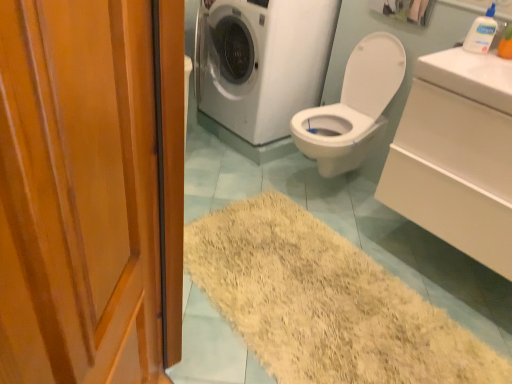
Describe the element at coordinates (78, 194) in the screenshot. Image resolution: width=512 pixels, height=384 pixels. I see `wooden door at left` at that location.

You are a GUI agent. You are given a task and a screenshot of the screen. Output one action in this format:
    pyautogui.click(x=<x>, y=<y>)
    Task: Click on the wooden door at left
    The height and width of the screenshot is (384, 512).
    Given the screenshot: What is the action you would take?
    pyautogui.click(x=78, y=194)

What do you see at coordinates (457, 155) in the screenshot? I see `white glossy sink at upper right, which is the second counter top in top-to-bottom order` at bounding box center [457, 155].

Locate an element on the screen. This screenshot has height=384, width=512. white glossy toilet at center is located at coordinates (353, 107).

You are a GUI agent. You are given a task and a screenshot of the screen. Output one action in this format:
    pyautogui.click(x=<x>, y=<y>)
    Task: Click on the white glossy washing machine at upper center
    The width and height of the screenshot is (512, 384).
    Given the screenshot: What is the action you would take?
    pyautogui.click(x=261, y=62)

The width and height of the screenshot is (512, 384). Find the location of `wooden door at left`. wooden door at left is located at coordinates (78, 194).

From the image's perspective, which is above, white glossy sink at upper right, which is counted as the 1th counter top, starting from the bottom, or white glossy sink at upper right, marked as the first counter top in a top-to-bottom arrangement?

white glossy sink at upper right, marked as the first counter top in a top-to-bottom arrangement, appears higher in the image.

Is white glossy sink at upper right, which is the second counter top in top-to-bottom order, in contact with white glossy sink at upper right, marked as the first counter top in a top-to-bottom arrangement?

white glossy sink at upper right, which is the second counter top in top-to-bottom order, and white glossy sink at upper right, marked as the first counter top in a top-to-bottom arrangement, are clearly separated.

Based on the photo, between white glossy sink at upper right, which is counted as the 1th counter top, starting from the bottom, and white glossy sink at upper right, the second counter top when ordered from bottom to top, which one has more height?

white glossy sink at upper right, which is counted as the 1th counter top, starting from the bottom.

Choose the correct answer: Is white glossy sink at upper right, which is counted as the 1th counter top, starting from the bottom, inside white glossy sink at upper right, marked as the first counter top in a top-to-bottom arrangement, or outside it?

white glossy sink at upper right, which is counted as the 1th counter top, starting from the bottom, is located beyond the bounds of white glossy sink at upper right, marked as the first counter top in a top-to-bottom arrangement.

Is clear plastic bottle at upper right positioned with its back to wooden door at left?

No, clear plastic bottle at upper right's orientation is not away from wooden door at left.

Between clear plastic bottle at upper right and wooden door at left, which one appears on the right side from the viewer's perspective?

From the viewer's perspective, clear plastic bottle at upper right appears more on the right side.

Does point (492, 3) come farther from viewer compared to point (75, 303)?

Yes, point (492, 3) is farther from viewer.

Does clear plastic bottle at upper right contain wooden door at left?

No.

Between white glossy washing machine at upper center and clear plastic bottle at upper right, which one has larger size?

Bigger between the two is white glossy washing machine at upper center.

From a real-world perspective, is white glossy washing machine at upper center positioned above or below clear plastic bottle at upper right?

white glossy washing machine at upper center is below clear plastic bottle at upper right.

Is white glossy washing machine at upper center aimed at clear plastic bottle at upper right?

No, white glossy washing machine at upper center is not facing towards clear plastic bottle at upper right.

Considering their positions, is white glossy washing machine at upper center located in front of or behind clear plastic bottle at upper right?

Visually, white glossy washing machine at upper center is located behind clear plastic bottle at upper right.

Considering the sizes of white glossy toilet at center and white glossy washing machine at upper center in the image, is white glossy toilet at center wider or thinner than white glossy washing machine at upper center?

white glossy toilet at center is thinner than white glossy washing machine at upper center.

How different are the orientations of white glossy toilet at center and white glossy washing machine at upper center in degrees?

2.86e-05 degrees separate the facing orientations of white glossy toilet at center and white glossy washing machine at upper center.

Is the depth of white glossy toilet at center greater than that of white glossy washing machine at upper center?

No, white glossy toilet at center is closer to the viewer.

Is white glossy toilet at center positioned with its back to white glossy washing machine at upper center?

No, white glossy toilet at center's orientation is not away from white glossy washing machine at upper center.

Locate an element on the screen. The image size is (512, 384). toilet paper on the left of white glossy sink at upper right, which is counted as the 1th counter top, starting from the bottom is located at coordinates (405, 10).

Considering the sizes of objects white glossy sink at upper right, which is the second counter top in top-to-bottom order, and white paper towel at upper center in the image provided, who is shorter, white glossy sink at upper right, which is the second counter top in top-to-bottom order, or white paper towel at upper center?

white paper towel at upper center.

From the image's perspective, between white glossy sink at upper right, which is the second counter top in top-to-bottom order, and white paper towel at upper center, which one is located above?

white paper towel at upper center is shown above in the image.

What's the angular difference between white glossy sink at upper right, which is the second counter top in top-to-bottom order, and white paper towel at upper center's facing directions?

0.198 degrees separate the facing orientations of white glossy sink at upper right, which is the second counter top in top-to-bottom order, and white paper towel at upper center.

Is white glossy washing machine at upper center a part of white glossy sink at upper right, which is counted as the 1th counter top, starting from the bottom?

No, white glossy washing machine at upper center is located outside of white glossy sink at upper right, which is counted as the 1th counter top, starting from the bottom.

Is white glossy sink at upper right, which is counted as the 1th counter top, starting from the bottom, facing towards white glossy washing machine at upper center?

No, white glossy sink at upper right, which is counted as the 1th counter top, starting from the bottom, is not facing towards white glossy washing machine at upper center.

From a real-world perspective, is white glossy sink at upper right, which is counted as the 1th counter top, starting from the bottom, located beneath white glossy washing machine at upper center?

No.

From a real-world perspective, which counter top is the 1st one above the white glossy washing machine at upper center? Please provide its 2D coordinates.

[(457, 155)]

Considering their positions, is white paper towel at upper center located in front of or behind white glossy sink at upper right, which is the second counter top in top-to-bottom order?

Clearly, white paper towel at upper center is behind white glossy sink at upper right, which is the second counter top in top-to-bottom order.

Which object is positioned more to the right, white paper towel at upper center or white glossy sink at upper right, which is counted as the 1th counter top, starting from the bottom?

From the viewer's perspective, white glossy sink at upper right, which is counted as the 1th counter top, starting from the bottom, appears more on the right side.

Is white paper towel at upper center shorter than white glossy sink at upper right, which is the second counter top in top-to-bottom order?

Yes.

From the image's perspective, which one is positioned lower, white paper towel at upper center or white glossy sink at upper right, which is counted as the 1th counter top, starting from the bottom?

white glossy sink at upper right, which is counted as the 1th counter top, starting from the bottom, from the image's perspective.

In order to click on counter top located below the white glossy sink at upper right, marked as the first counter top in a top-to-bottom arrangement (from the image's perspective) in this screenshot , I will do `click(457, 155)`.

Locate an element on the screen. toiletry above the wooden door at left (from the image's perspective) is located at coordinates (481, 32).

Looking at the image, which one is located closer to white glossy washing machine at upper center, clear plastic bottle at upper right or wooden door at left?

Among the two, clear plastic bottle at upper right is located nearer to white glossy washing machine at upper center.

Which object lies nearer to the anchor point white glossy washing machine at upper center, white glossy toilet at center or wooden door at left?

white glossy toilet at center is positioned closer to the anchor white glossy washing machine at upper center.

From the image, which object appears to be farther from white glossy sink at upper right, which is counted as the 1th counter top, starting from the bottom, white glossy sink at upper right, marked as the first counter top in a top-to-bottom arrangement, or white paper towel at upper center?

Based on the image, white paper towel at upper center appears to be further to white glossy sink at upper right, which is counted as the 1th counter top, starting from the bottom.

Which object lies nearer to the anchor point white glossy washing machine at upper center, clear plastic bottle at upper right or white glossy sink at upper right, the second counter top when ordered from bottom to top?

white glossy sink at upper right, the second counter top when ordered from bottom to top, is positioned closer to the anchor white glossy washing machine at upper center.

From the image, which object appears to be farther from white glossy sink at upper right, the second counter top when ordered from bottom to top, white glossy toilet at center or clear plastic bottle at upper right?

Among the two, white glossy toilet at center is located further to white glossy sink at upper right, the second counter top when ordered from bottom to top.

From the image, which object appears to be farther from white glossy sink at upper right, which is the second counter top in top-to-bottom order, white glossy toilet at center or wooden door at left?

wooden door at left is positioned further to the anchor white glossy sink at upper right, which is the second counter top in top-to-bottom order.

Which object lies nearer to the anchor point wooden door at left, clear plastic bottle at upper right or white glossy washing machine at upper center?

clear plastic bottle at upper right.

Looking at the image, which one is located closer to white glossy sink at upper right, which is counted as the 1th counter top, starting from the bottom, white glossy washing machine at upper center or clear plastic bottle at upper right?

Among the two, clear plastic bottle at upper right is located nearer to white glossy sink at upper right, which is counted as the 1th counter top, starting from the bottom.

Where is `toiletry between white glossy toilet at center and white glossy sink at upper right, which is the second counter top in top-to-bottom order, from left to right`? The height and width of the screenshot is (384, 512). toiletry between white glossy toilet at center and white glossy sink at upper right, which is the second counter top in top-to-bottom order, from left to right is located at coordinates (481, 32).

At what (x,y) coordinates should I click in order to perform the action: click on counter top situated between white glossy toilet at center and clear plastic bottle at upper right from left to right. Please return your answer as a coordinate pair (x, y). This screenshot has height=384, width=512. Looking at the image, I should click on (470, 76).

Locate an element on the screen. This screenshot has width=512, height=384. counter top between white paper towel at upper center and white glossy toilet at center in the up-down direction is located at coordinates (470, 76).

Find the location of a particular element. The height and width of the screenshot is (384, 512). toilet paper between white glossy washing machine at upper center and white glossy sink at upper right, marked as the first counter top in a top-to-bottom arrangement, in the horizontal direction is located at coordinates (405, 10).